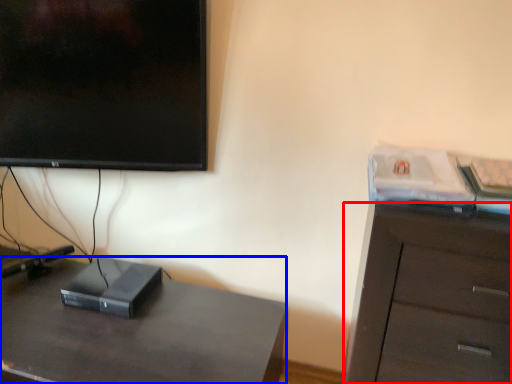
Question: Which object is closer to the camera taking this photo, cabinetry (highlighted by a red box) or desk (highlighted by a blue box)?

Choices:
 (A) cabinetry
 (B) desk

Answer: (A)